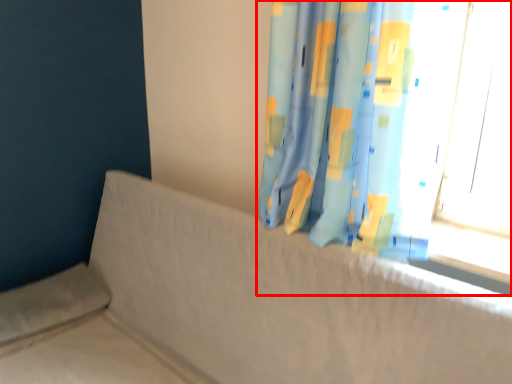
Question: From the image's perspective, what is the correct spatial positioning of curtain (annotated by the red box) in reference to couch?

Choices:
 (A) above
 (B) below

Answer: (A)